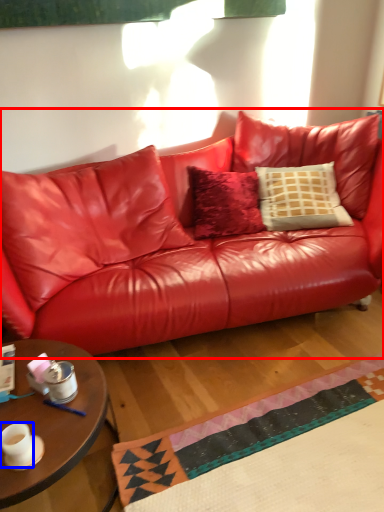
Question: Among these objects, which one is nearest to the camera, studio couch (highlighted by a red box) or coffee cup (highlighted by a blue box)?

Choices:
 (A) studio couch
 (B) coffee cup

Answer: (B)